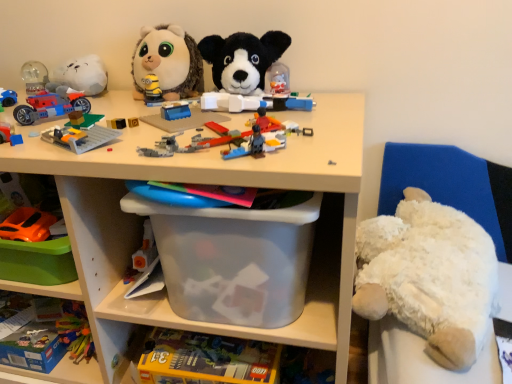
Question: In terms of height, does matte plastic car at left, which is the fifth toy from top to bottom, look taller or shorter compared to shiny plastic motorcycle at left, placed as the third toy when sorted from top to bottom?

Choices:
 (A) tall
 (B) short

Answer: (B)

Question: Considering the positions of point (18, 142) and point (24, 105), is point (18, 142) closer or farther from the camera than point (24, 105)?

Choices:
 (A) closer
 (B) farther

Answer: (A)

Question: Which object is positioned farthest from the white fluffy teddy bear at right?

Choices:
 (A) transparent plastic storage box at lower center, arranged as the 2th storage box when viewed from the top
 (B) transparent plastic storage box at center, marked as the first storage box in a top-to-bottom arrangement
 (C) matte plastic car at left, which is the fifth toy from top to bottom
 (D) shiny plastic motorcycle at left, which is counted as the fifth toy, starting from the bottom
 (E) translucent plastic lego pieces at center, acting as the 4th toy starting from the top

Answer: (C)

Question: Estimate the real-world distances between objects in this image. Which object is farther from the orange matte car at lower left, the seventh toy when ordered from top to bottom?

Choices:
 (A) white plush bear at right
 (B) translucent plastic lego pieces at center, acting as the 4th toy starting from the top
 (C) transparent plastic storage box at center, the 2th storage box in the bottom-to-top sequence
 (D) blue plastic shelf at lower left, the first shelf from the bottom
 (E) transparent plastic storage box at lower center, arranged as the 2th storage box when viewed from the top

Answer: (A)